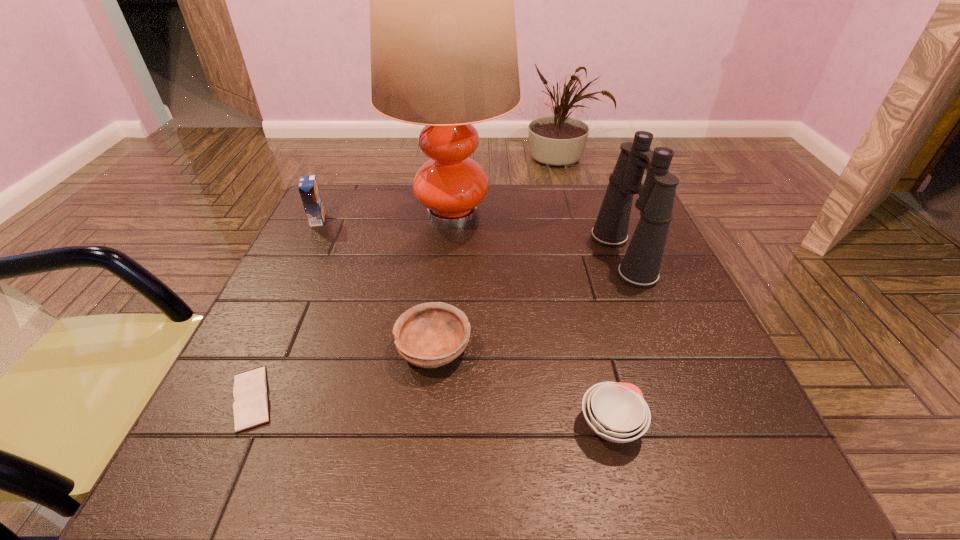
Locate an element on the screen. The width and height of the screenshot is (960, 540). free location located on the left of the bowl is located at coordinates (278, 349).

At what (x,y) coordinates should I click in order to perform the action: click on vacant space located on the left of the fifth object from left to right. Please return your answer as a coordinate pair (x, y). Looking at the image, I should click on (367, 425).

Find the location of a particular element. vacant space situated 0.250m on the back of the diary is located at coordinates (307, 276).

Find the location of a particular element. This screenshot has width=960, height=540. lamp present at the far edge is located at coordinates (443, 43).

Image resolution: width=960 pixels, height=540 pixels. Find the location of `binoculars that is positioned at the far edge`. binoculars that is positioned at the far edge is located at coordinates (640, 266).

Identify the location of orange_juice located at the far edge. coord(308,187).

Find the location of a particular element. The width and height of the screenshot is (960, 540). soup bowl present at the near edge is located at coordinates (617, 412).

Find the location of a particular element. The height and width of the screenshot is (540, 960). diary situated at the near edge is located at coordinates [250, 408].

Identify the location of orange_juice at the left edge. (308, 187).

Locate an element on the screen. diary at the left edge is located at coordinates (250, 408).